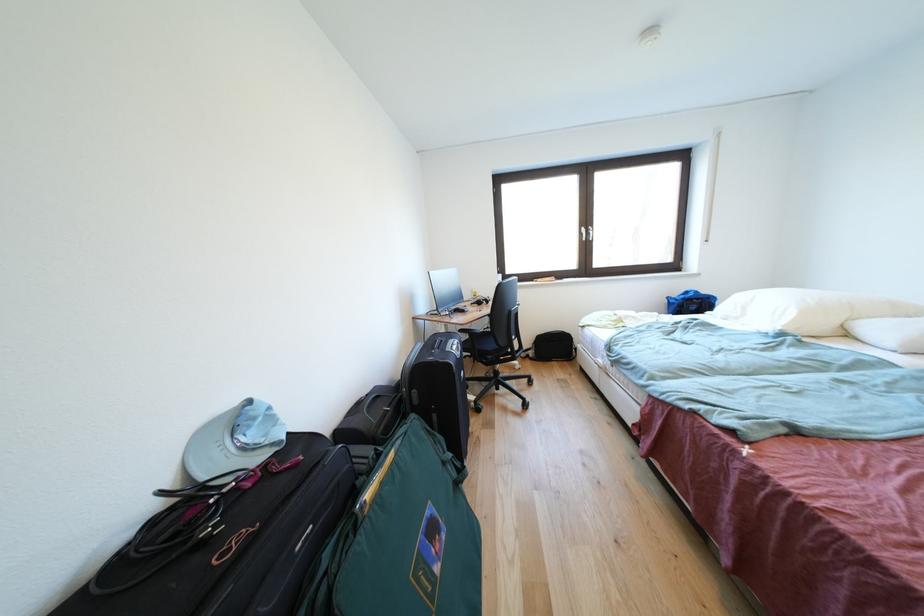
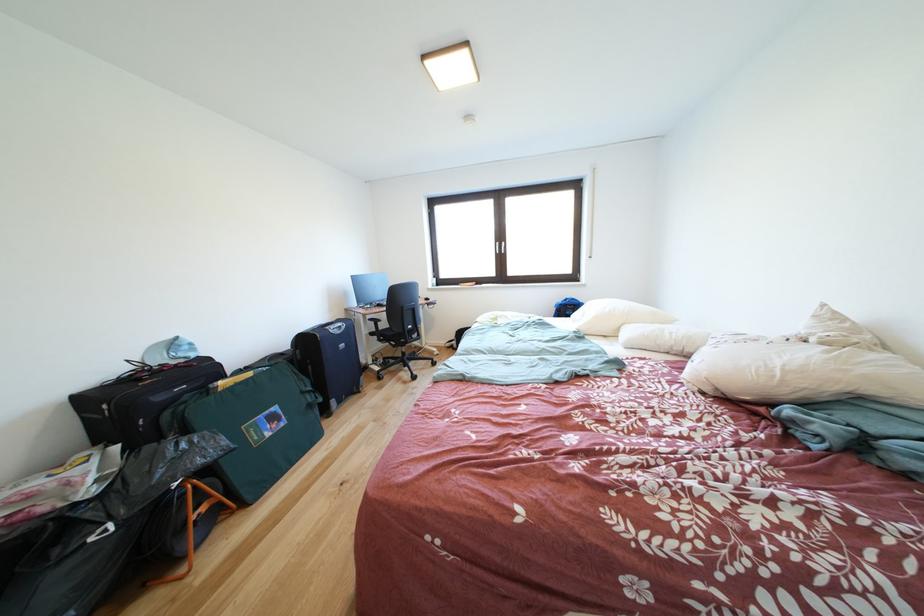
Find the pixel in the second image that matches point 305,469 in the first image.

(200, 371)